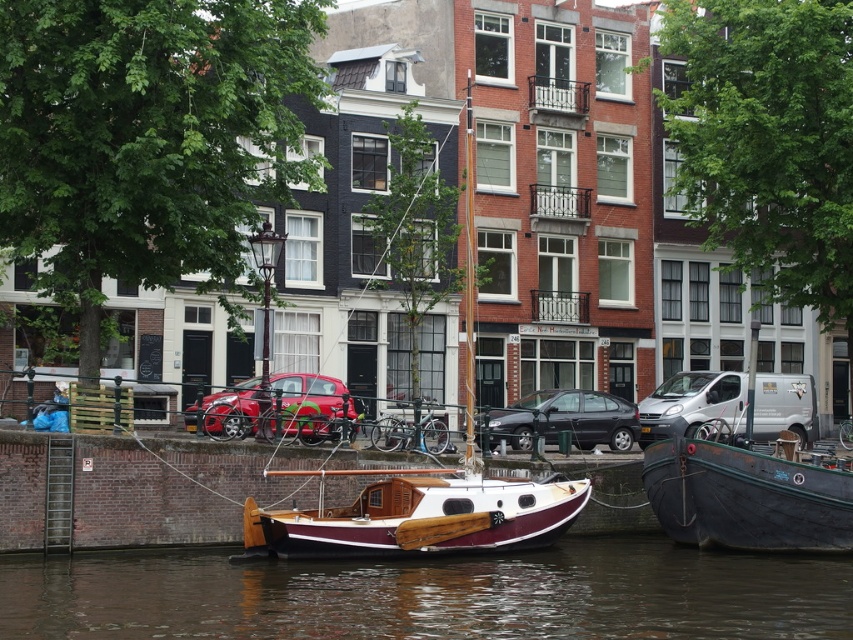
Question: Is wooden sailboat at center to the left of metallic red car at center from the viewer's perspective?

Choices:
 (A) no
 (B) yes

Answer: (A)

Question: From the image, what is the correct spatial relationship of wooden polished boat at center in relation to metallic red car at center?

Choices:
 (A) right
 (B) left

Answer: (A)

Question: Which point is farther from the camera taking this photo?

Choices:
 (A) (811, 497)
 (B) (428, 513)

Answer: (A)

Question: Which of the following is the closest to the observer?

Choices:
 (A) (740, 502)
 (B) (410, 470)

Answer: (B)

Question: Which point appears farthest from the camera in this image?

Choices:
 (A) (332, 544)
 (B) (494, 586)
 (C) (315, 547)
 (D) (314, 416)

Answer: (D)

Question: Can you confirm if wooden polished boat at center is positioned below metallic red car at center?

Choices:
 (A) no
 (B) yes

Answer: (B)